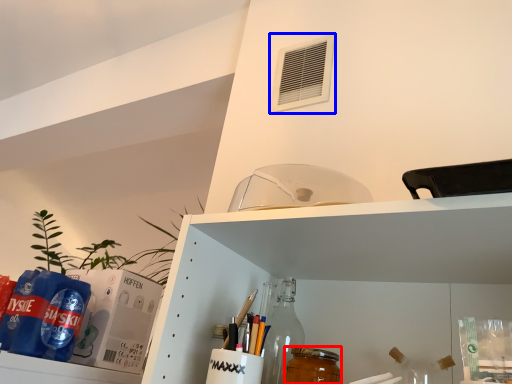
Question: Which object is closer to the camera taking this photo, beverage (highlighted by a red box) or air conditioning (highlighted by a blue box)?

Choices:
 (A) beverage
 (B) air conditioning

Answer: (A)